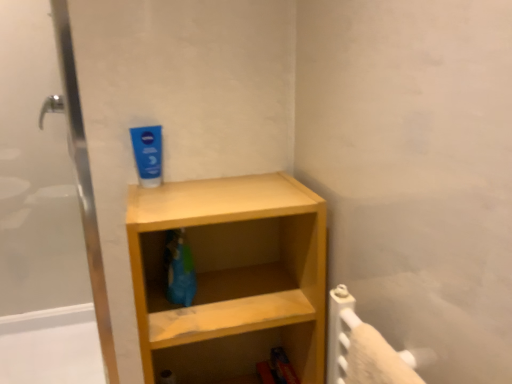
Question: From a real-world perspective, is blue matte toothpaste at upper center beneath light wood shelf at center?

Choices:
 (A) yes
 (B) no

Answer: (B)

Question: Does blue matte toothpaste at upper center appear on the right side of light wood shelf at center?

Choices:
 (A) no
 (B) yes

Answer: (A)

Question: Considering the relative positions of blue matte toothpaste at upper center and light wood shelf at center in the image provided, is blue matte toothpaste at upper center in front of light wood shelf at center?

Choices:
 (A) yes
 (B) no

Answer: (B)

Question: Is blue matte toothpaste at upper center thinner than light wood shelf at center?

Choices:
 (A) no
 (B) yes

Answer: (B)

Question: Can you confirm if blue matte toothpaste at upper center is bigger than light wood shelf at center?

Choices:
 (A) yes
 (B) no

Answer: (B)

Question: Is blue matte toothpaste at upper center positioned far away from light wood shelf at center?

Choices:
 (A) yes
 (B) no

Answer: (B)

Question: Can you confirm if light wood shelf at center is thinner than blue matte toothpaste at upper center?

Choices:
 (A) no
 (B) yes

Answer: (A)

Question: Is light wood shelf at center taller than blue matte toothpaste at upper center?

Choices:
 (A) no
 (B) yes

Answer: (B)

Question: Is light wood shelf at center turned away from blue matte toothpaste at upper center?

Choices:
 (A) yes
 (B) no

Answer: (B)

Question: Are light wood shelf at center and blue matte toothpaste at upper center far apart?

Choices:
 (A) yes
 (B) no

Answer: (B)

Question: From the image's perspective, does light wood shelf at center appear higher than blue matte toothpaste at upper center?

Choices:
 (A) no
 (B) yes

Answer: (A)

Question: From the image's perspective, is light wood shelf at center located beneath blue matte toothpaste at upper center?

Choices:
 (A) yes
 (B) no

Answer: (A)

Question: Is blue matte toothpaste at upper center spatially inside light wood shelf at center, or outside of it?

Choices:
 (A) inside
 (B) outside

Answer: (B)